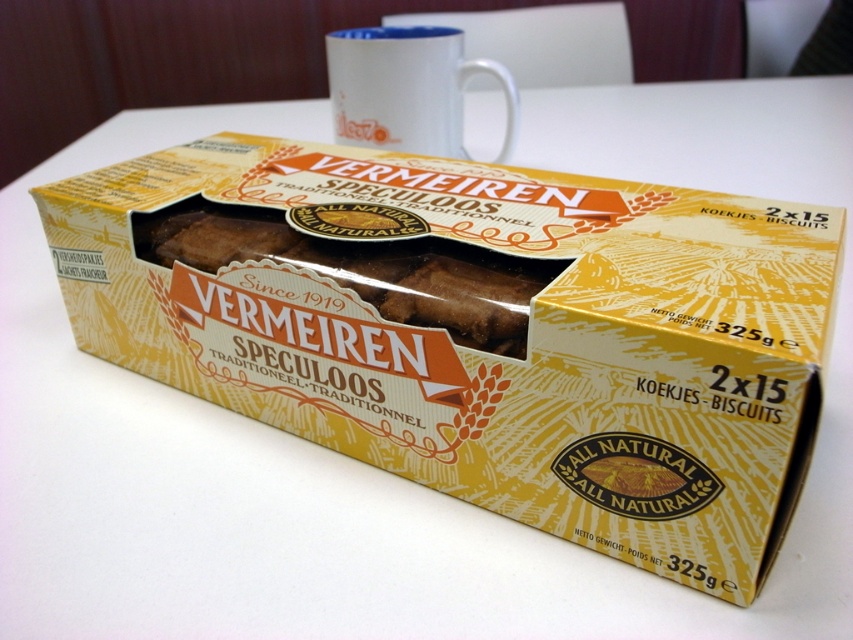
Question: Is brown matte speculoos box at center above brown crumbly biscuit at center?

Choices:
 (A) no
 (B) yes

Answer: (A)

Question: Which of the following is the closest to the observer?

Choices:
 (A) brown matte speculoos box at center
 (B) white ceramic mug at upper center

Answer: (A)

Question: Is brown matte speculoos box at center to the right of white ceramic mug at upper center from the viewer's perspective?

Choices:
 (A) yes
 (B) no

Answer: (A)

Question: Which object is the farthest from the brown matte speculoos box at center?

Choices:
 (A) white ceramic mug at upper center
 (B) brown crumbly biscuit at center

Answer: (A)

Question: Considering the relative positions of brown crumbly biscuit at center and white ceramic mug at upper center in the image provided, where is brown crumbly biscuit at center located with respect to white ceramic mug at upper center?

Choices:
 (A) below
 (B) above

Answer: (A)

Question: Which object is closer to the camera taking this photo?

Choices:
 (A) brown crumbly biscuit at center
 (B) brown matte speculoos box at center
 (C) white ceramic mug at upper center

Answer: (B)